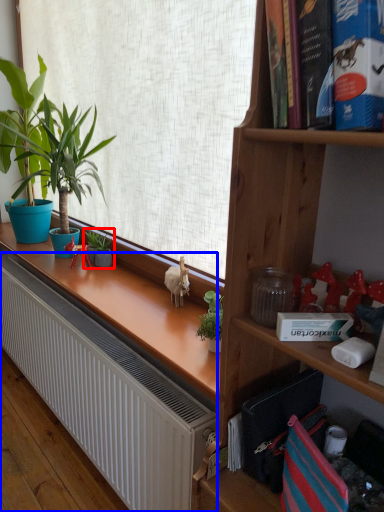
Question: Among these objects, which one is nearest to the camera, houseplant (highlighted by a red box) or radiator (highlighted by a blue box)?

Choices:
 (A) houseplant
 (B) radiator

Answer: (B)